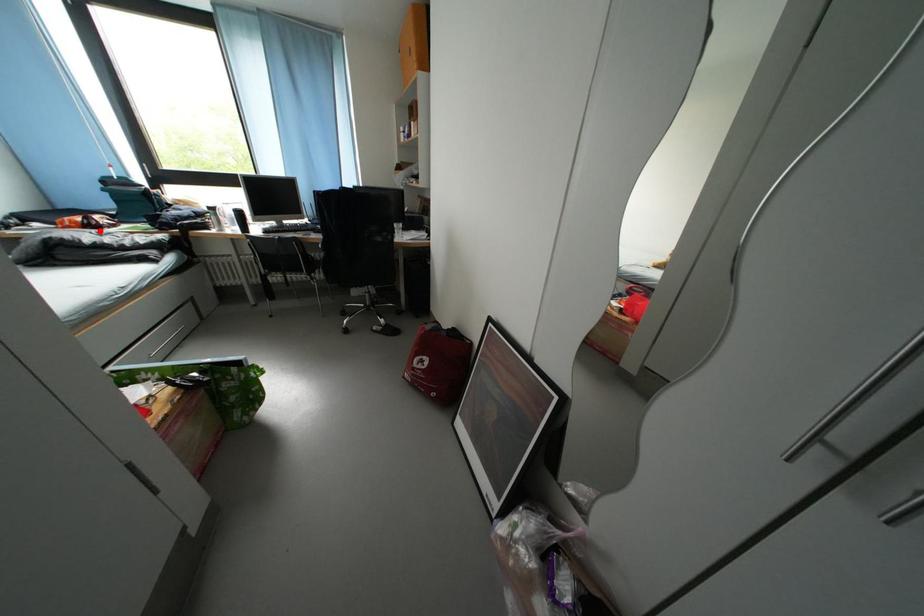
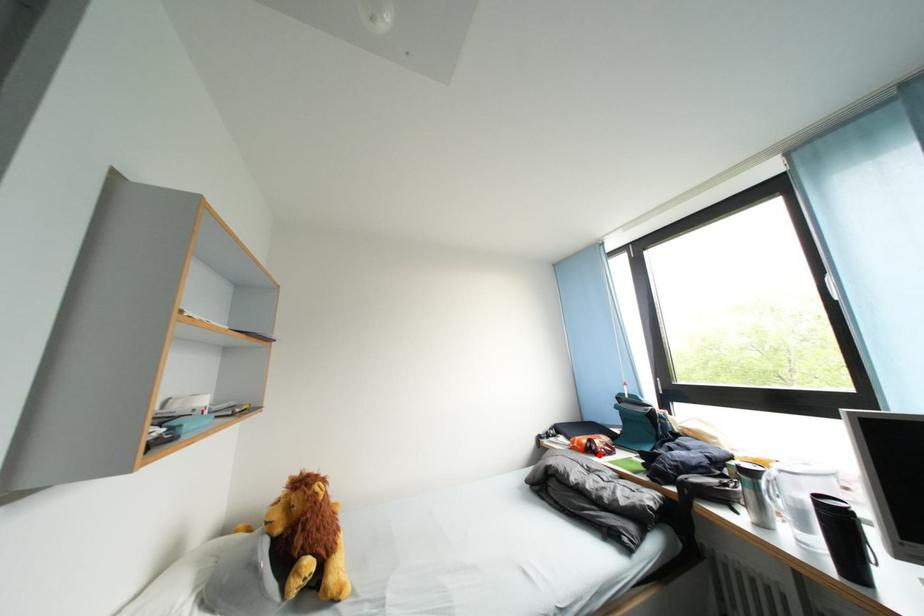
I am providing you with two images of the same scene from different viewpoints. A red point is marked on the first image and another point is marked on the second image. Do the highlighted points in image1 and image2 indicate the same real-world spot?

Yes